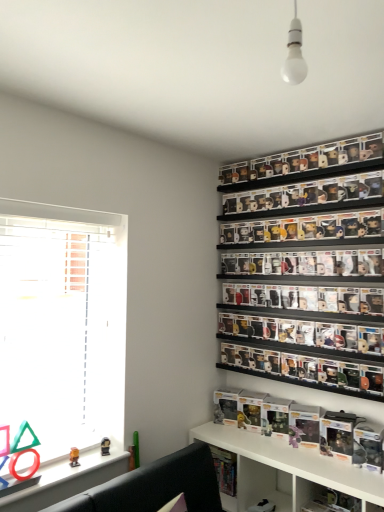
I want to click on blank space situated above white glossy shelf at lower center, marked as the 4th shelf in a top-to-bottom arrangement (from a real-world perspective), so click(x=302, y=450).